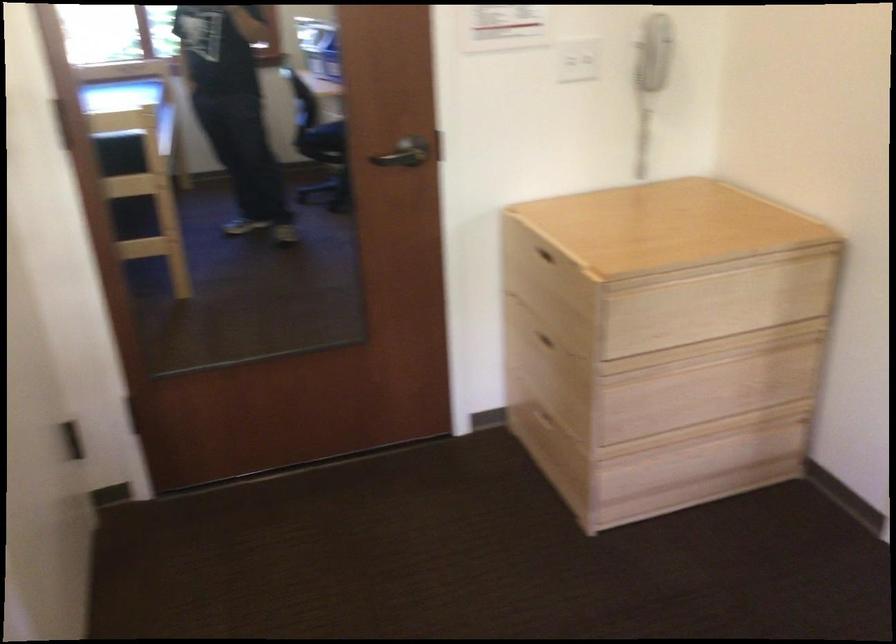
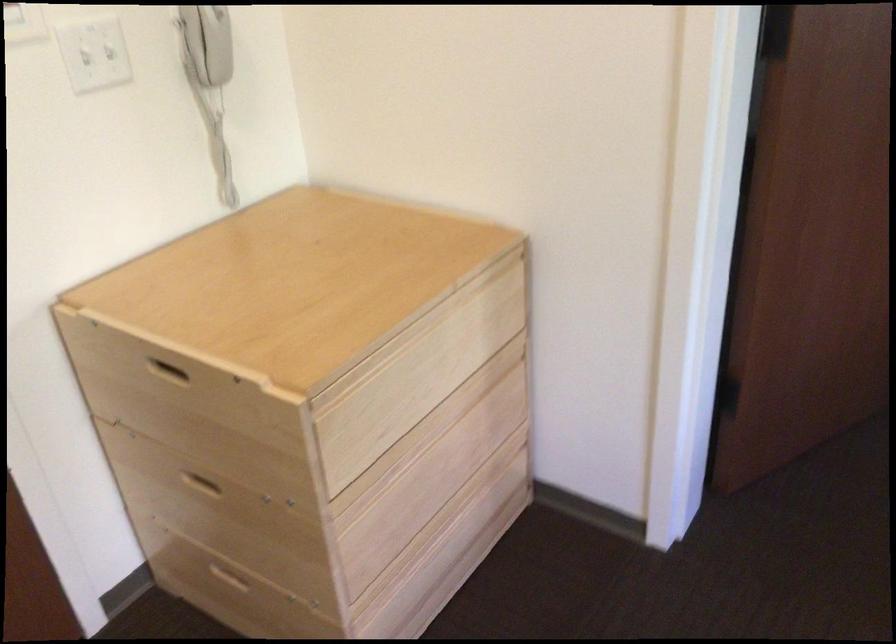
In the second image, find the point that corresponds to point (543, 256) in the first image.

(168, 372)